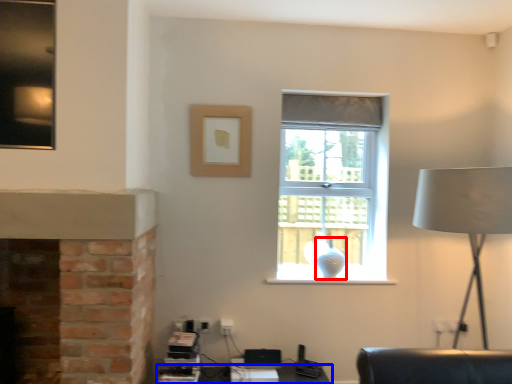
Question: Which object appears closest to the camera in this image, glass vase (highlighted by a red box) or table (highlighted by a blue box)?

Choices:
 (A) glass vase
 (B) table

Answer: (B)